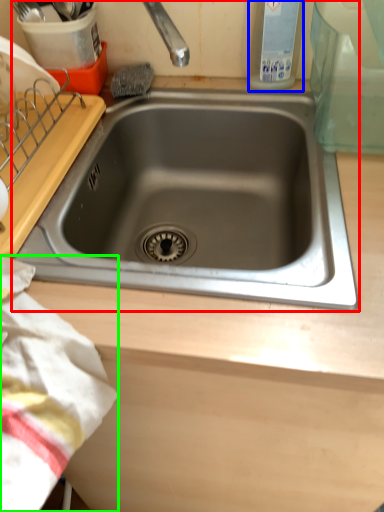
Question: Considering the real-world distances, which object is farthest from sink (highlighted by a red box)? bottle (highlighted by a blue box) or blanket (highlighted by a green box)?

Choices:
 (A) bottle
 (B) blanket

Answer: (B)